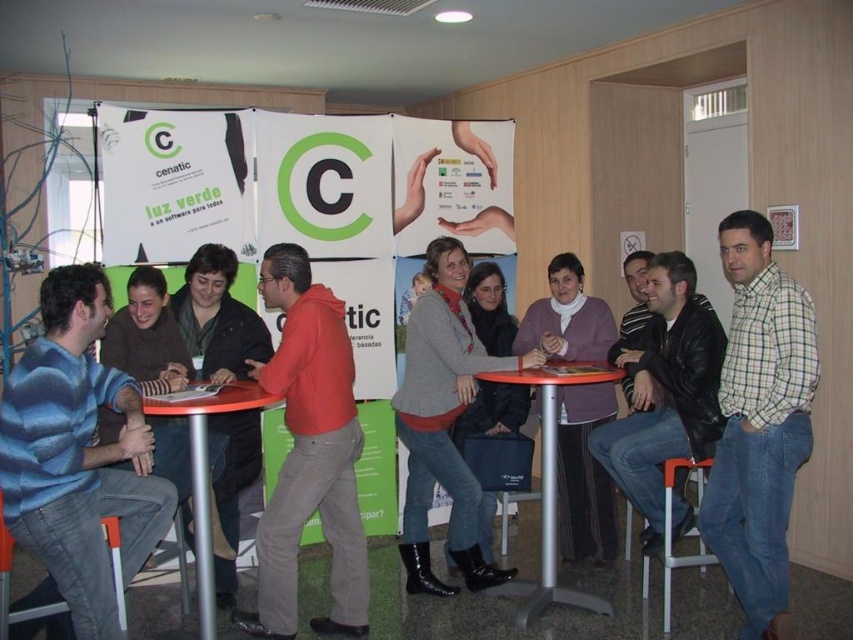
You are standing at the entrance of the conference room. You see a leather jacket at center. Where is the leather jacket located in terms of coordinates?

The leather jacket at center is located at coordinates point [664,392].

Based on the photo, based on the scene description, where is the plaid cotton shirt at center located in terms of coordinates?

The plaid cotton shirt at center is located at coordinates 0.744 on the x axis and 0.686 on the y axis.

In the scene shown: You are standing in the conference room and want to take a photo of both the point at position (647, 358) and the point at (511, 588). Which point should you focus on first to ensure both are in focus?

You should focus on the point at position (647, 358) first because it is closer to the camera, and focusing on the closer object will keep the farther one in focus as well.